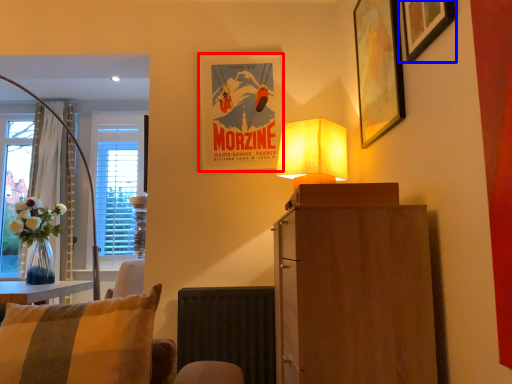
Question: Which object is closer to the camera taking this photo, picture frame (highlighted by a red box) or picture frame (highlighted by a blue box)?

Choices:
 (A) picture frame
 (B) picture frame

Answer: (B)